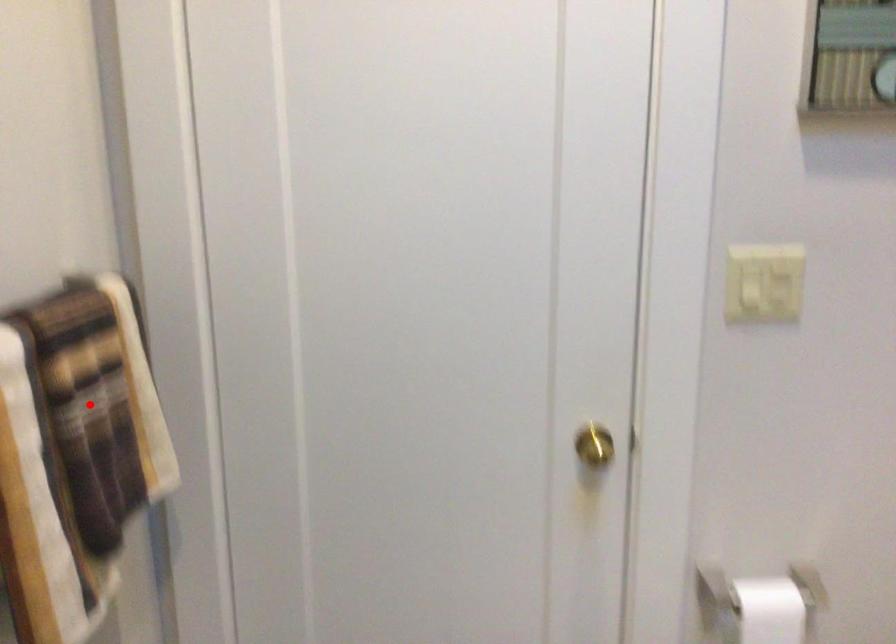
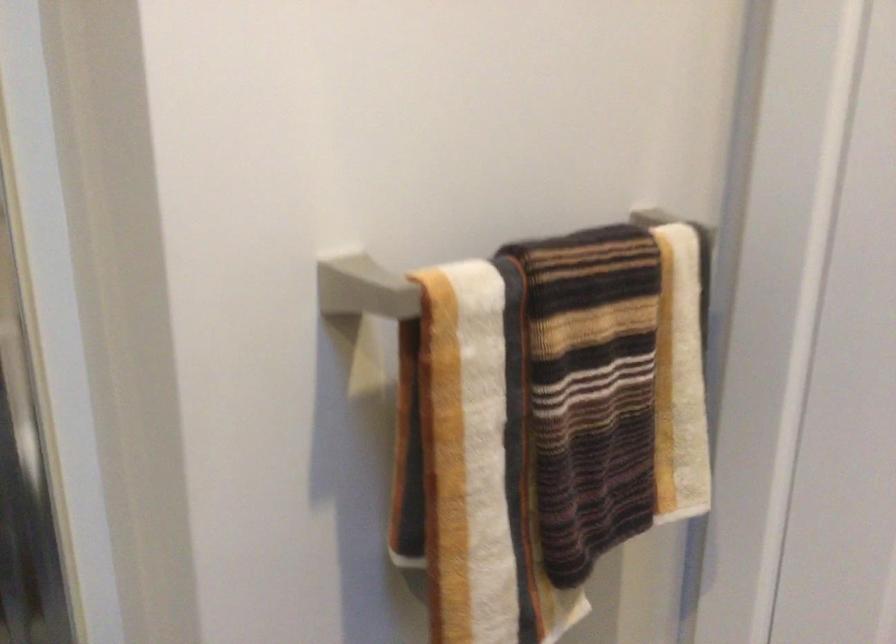
Where in the second image is the point corresponding to the highlighted location from the first image?

(590, 389)